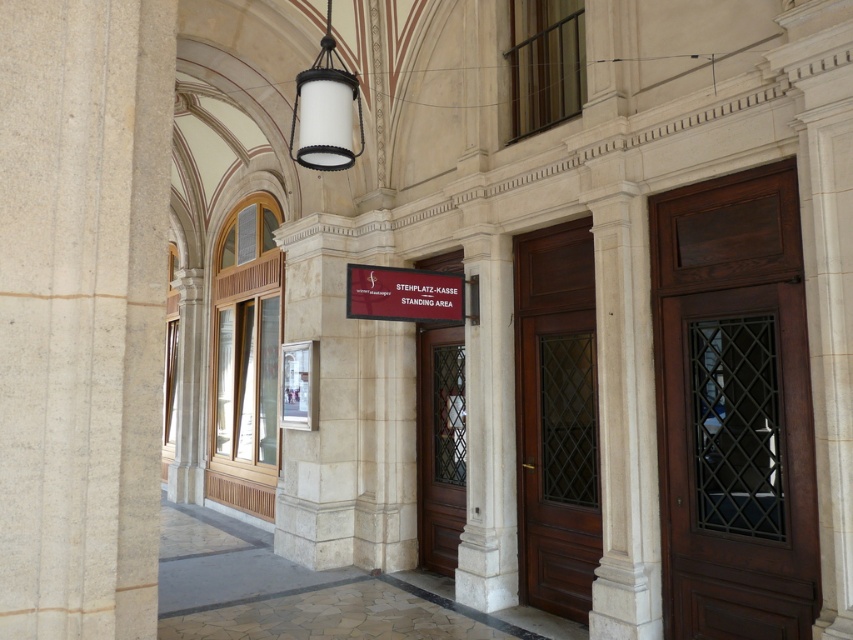
You are standing in front of the entrance of the classical building. You need to open the door to enter. Which door should you choose, the mahogany wood door at center or the brown wooden door at center?

You should choose the mahogany wood door at center because it is closer to you than the brown wooden door at center, so it is the actual entrance door.

You are an architect visiting the building and need to determine which door is wider for structural analysis. Which door has a greater width between the mahogany wood door at center and the brown wooden door at center?

The mahogany wood door at center has a greater width than the brown wooden door at center as stated in the description.